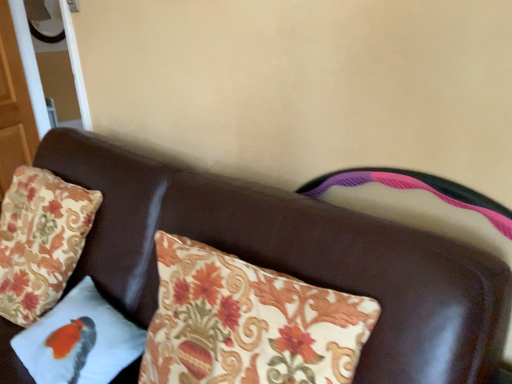
Question: From a real-world perspective, is white fabric pillow with bird design at lower left, positioned as the first pillow in right-to-left order, on floral fabric pillow at left, arranged as the 1th pillow when viewed from the left?

Choices:
 (A) yes
 (B) no

Answer: (B)

Question: Is white fabric pillow with bird design at lower left, the 2th pillow viewed from the left, aimed at floral fabric pillow at left, which is counted as the 2th pillow, starting from the right?

Choices:
 (A) yes
 (B) no

Answer: (B)

Question: Does white fabric pillow with bird design at lower left, the 2th pillow viewed from the left, touch floral fabric pillow at left, arranged as the 1th pillow when viewed from the left?

Choices:
 (A) no
 (B) yes

Answer: (A)

Question: Is white fabric pillow with bird design at lower left, positioned as the first pillow in right-to-left order, taller than floral fabric pillow at left, arranged as the 1th pillow when viewed from the left?

Choices:
 (A) no
 (B) yes

Answer: (A)

Question: Is the depth of white fabric pillow with bird design at lower left, positioned as the first pillow in right-to-left order, less than that of floral fabric pillow at left, which is counted as the 2th pillow, starting from the right?

Choices:
 (A) yes
 (B) no

Answer: (A)

Question: Is floral fabric pillow at left, which is counted as the 2th pillow, starting from the right, taller or shorter than brown leather couch at center?

Choices:
 (A) short
 (B) tall

Answer: (A)

Question: Is floral fabric pillow at left, arranged as the 1th pillow when viewed from the left, situated inside brown leather couch at center or outside?

Choices:
 (A) inside
 (B) outside

Answer: (A)

Question: From the image's perspective, is floral fabric pillow at left, which is counted as the 2th pillow, starting from the right, positioned above or below brown leather couch at center?

Choices:
 (A) below
 (B) above

Answer: (B)

Question: From a real-world perspective, relative to brown leather couch at center, is floral fabric pillow at left, which is counted as the 2th pillow, starting from the right, vertically above or below?

Choices:
 (A) above
 (B) below

Answer: (A)

Question: Looking at their shapes, would you say brown leather couch at center is wider or thinner than floral fabric pillow at left, which is counted as the 2th pillow, starting from the right?

Choices:
 (A) wide
 (B) thin

Answer: (A)

Question: Is brown leather couch at center bigger or smaller than floral fabric pillow at left, arranged as the 1th pillow when viewed from the left?

Choices:
 (A) big
 (B) small

Answer: (A)

Question: In terms of height, does brown leather couch at center look taller or shorter compared to floral fabric pillow at left, which is counted as the 2th pillow, starting from the right?

Choices:
 (A) short
 (B) tall

Answer: (B)

Question: In the image, is brown leather couch at center positioned in front of or behind floral fabric pillow at left, which is counted as the 2th pillow, starting from the right?

Choices:
 (A) behind
 (B) front

Answer: (B)

Question: Looking at their shapes, would you say white fabric pillow with bird design at lower left, positioned as the first pillow in right-to-left order, is wider or thinner than brown leather couch at center?

Choices:
 (A) wide
 (B) thin

Answer: (B)

Question: Is white fabric pillow with bird design at lower left, the 2th pillow viewed from the left, spatially inside brown leather couch at center, or outside of it?

Choices:
 (A) outside
 (B) inside

Answer: (B)